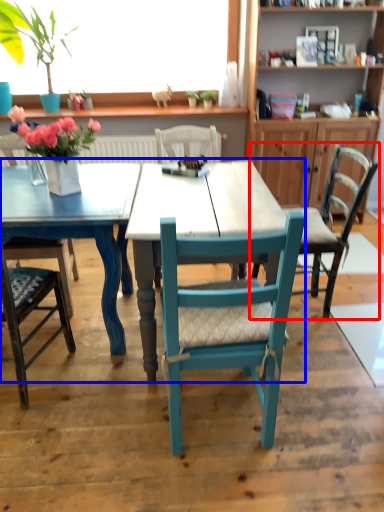
Question: Which object is further to the camera taking this photo, chair (highlighted by a red box) or kitchen & dining room table (highlighted by a blue box)?

Choices:
 (A) chair
 (B) kitchen & dining room table

Answer: (A)